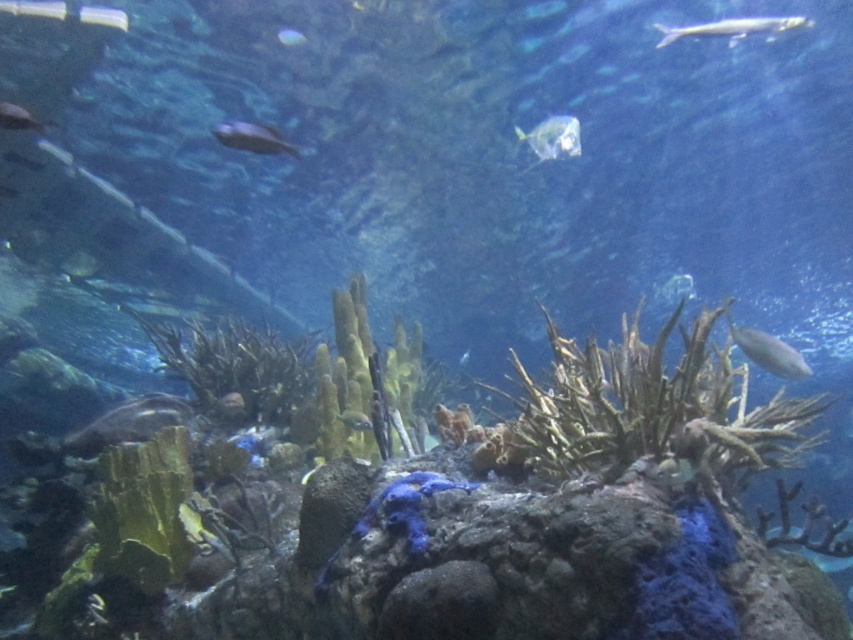
Question: Which object is the farthest from the greenish-brown textured coral reef at center?

Choices:
 (A) shiny silver fish at upper left
 (B) shiny silver fish at center
 (C) translucent silver fish at upper right
 (D) shiny blue fish at upper center

Answer: (C)

Question: Which point is closer to the camera?

Choices:
 (A) (248, 148)
 (B) (775, 362)
 (C) (355, 420)
 (D) (671, 289)

Answer: (A)

Question: Is greenish-brown textured coral reef at center wider than shiny silver fish at right?

Choices:
 (A) no
 (B) yes

Answer: (B)

Question: Among these points, which one is farthest from the camera?

Choices:
 (A) (222, 124)
 (B) (532, 147)
 (C) (370, 422)

Answer: (A)

Question: From the image, what is the correct spatial relationship of shiny silver fish at right in relation to shiny silver fish at center?

Choices:
 (A) below
 (B) above

Answer: (B)

Question: Does translucent silver fish at upper right have a lesser width compared to shiny silver fish at right?

Choices:
 (A) no
 (B) yes

Answer: (A)